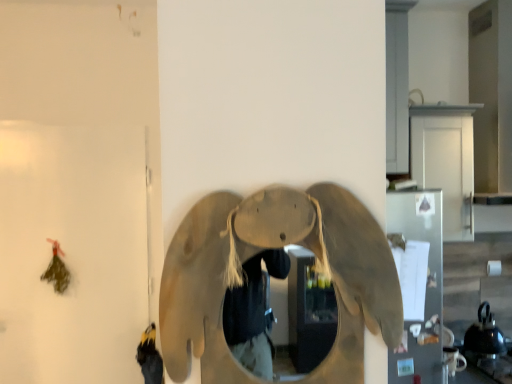
Question: Is point (373, 329) positioned closer to the camera than point (440, 311)?

Choices:
 (A) closer
 (B) farther

Answer: (A)

Question: In the image, is matte beige elephant at center positioned in front of or behind metallic silver refrigerator at right?

Choices:
 (A) behind
 (B) front

Answer: (B)

Question: Considering the positions of matte beige elephant at center and metallic silver refrigerator at right in the image, is matte beige elephant at center bigger or smaller than metallic silver refrigerator at right?

Choices:
 (A) big
 (B) small

Answer: (A)

Question: Based on their sizes in the image, would you say metallic silver refrigerator at right is bigger or smaller than matte beige elephant at center?

Choices:
 (A) small
 (B) big

Answer: (A)

Question: Considering their positions, is metallic silver refrigerator at right located in front of or behind matte beige elephant at center?

Choices:
 (A) behind
 (B) front

Answer: (A)

Question: Does point (402, 206) appear closer or farther from the camera than point (205, 253)?

Choices:
 (A) closer
 (B) farther

Answer: (B)

Question: Is metallic silver refrigerator at right wider or thinner than matte beige elephant at center?

Choices:
 (A) wide
 (B) thin

Answer: (B)